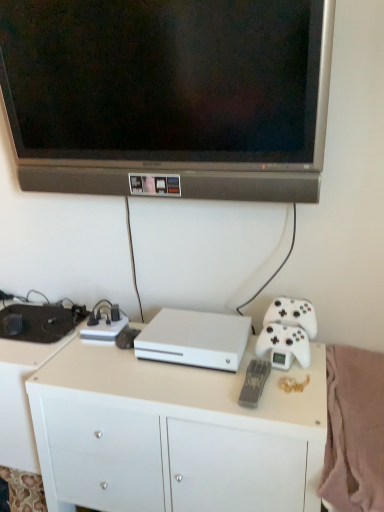
The width and height of the screenshot is (384, 512). I want to click on free space in front of white matte console at center, so click(x=196, y=390).